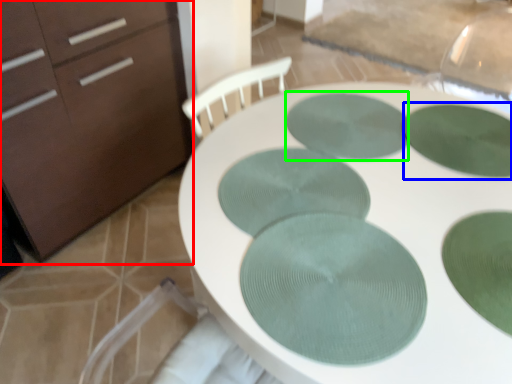
Question: Based on their relative distances, which object is farther from chest of drawers (highlighted by a red box)? Choose from glass plate (highlighted by a blue box) and glass plate (highlighted by a green box).

Choices:
 (A) glass plate
 (B) glass plate

Answer: (A)